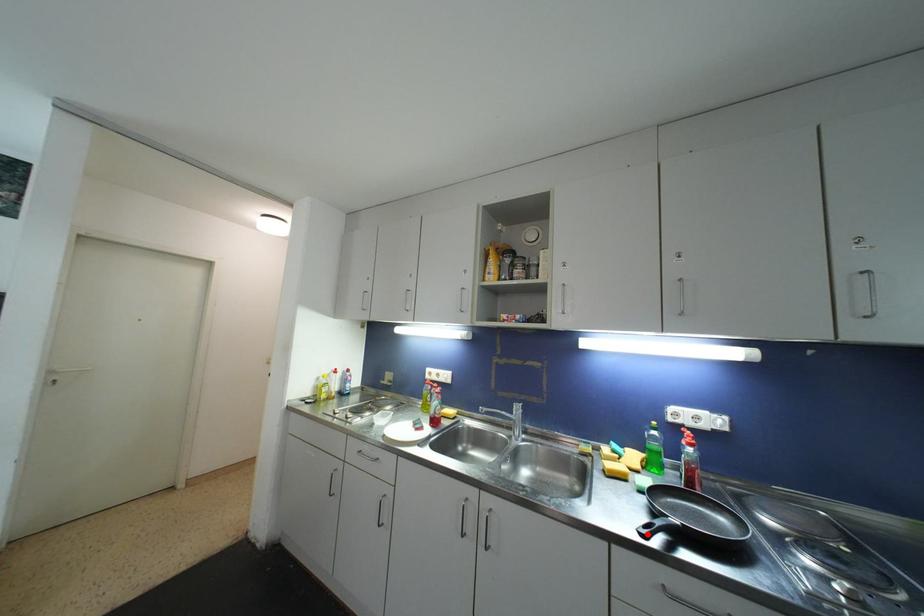
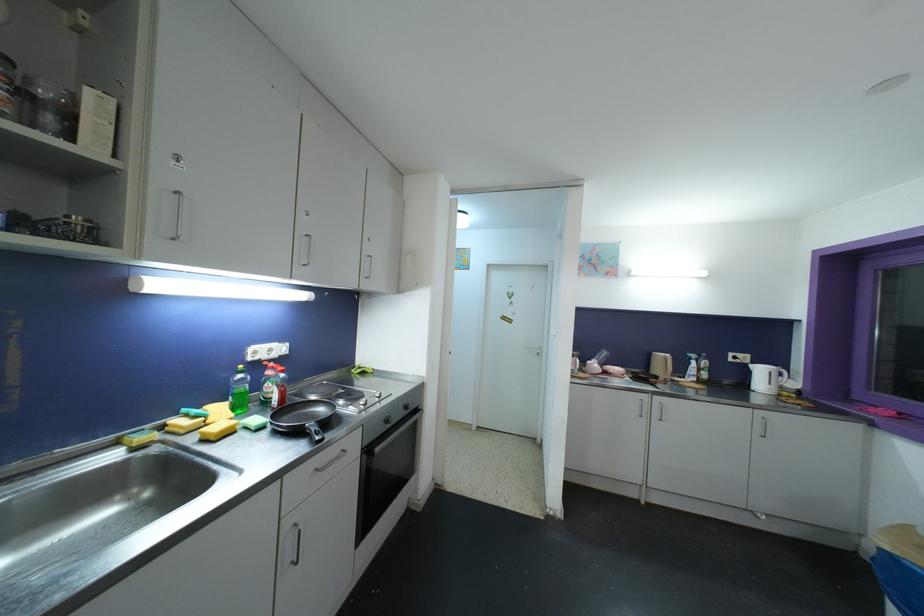
Question: I am providing you with two images of the same scene from different viewpoints. Given a red point in image1, look at the same physical point in image2. Is it:

Choices:
 (A) Closer to the viewpoint
 (B) Farther from the viewpoint

Answer: (A)